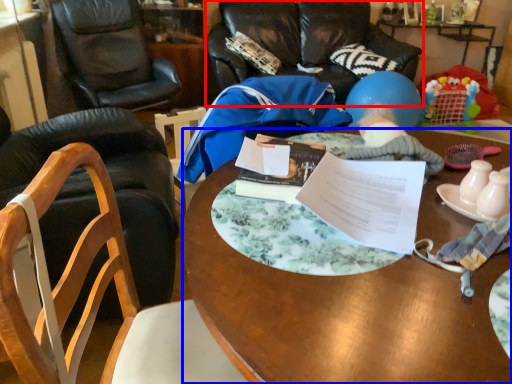
Question: Which object appears farthest to the camera in this image, chair (highlighted by a red box) or desk (highlighted by a blue box)?

Choices:
 (A) chair
 (B) desk

Answer: (A)